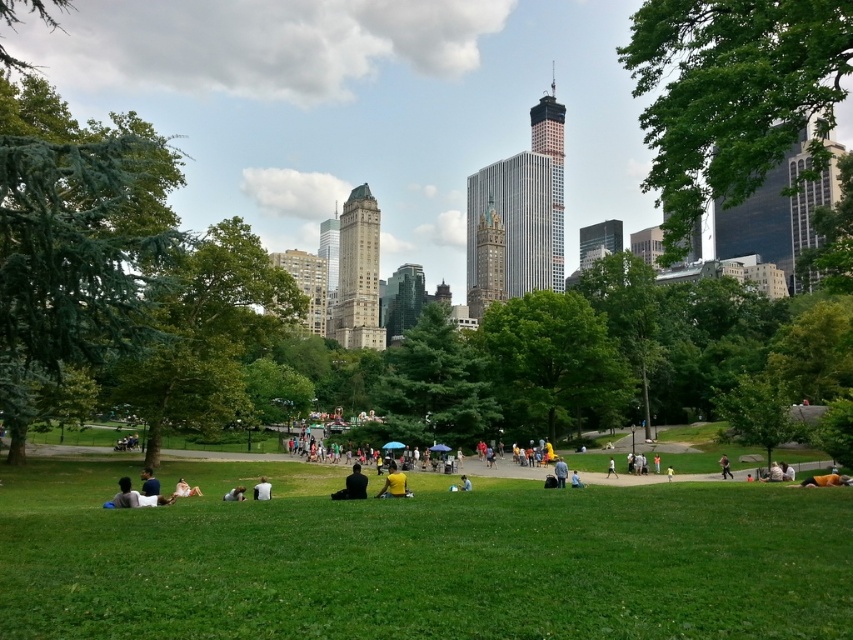
You are standing in the park and want to take a photo of the light brown leather jacket at center. To ensure it appears larger in your photo, should you move closer to or farther away from the green grassy field at center?

To make the light brown leather jacket at center appear larger in the photo, you should move closer to the green grassy field at center because the green grassy field at center is closer to the viewer than the light brown leather jacket at center. Moving closer to the field would also bring you closer to the jacket, making it larger in the frame.

You are a park ranger who needs to check the distance between the green grassy field at center and the light brown leather jacket at center. According to the park map, the minimum safe distance for public gatherings is 65 meters. Is the current distance compliant with the safety guidelines?

The green grassy field at center and the light brown leather jacket at center are 64.95 meters apart from each other, which is just below the required 65 meters. Therefore, the current distance does not comply with the safety guidelines.

You are standing in the park and want to reach a specific point marked at coordinates point (360, 486). If your current position is 50 feet away from this point, how much farther do you need to walk to reach it?

The distance of point (360, 486) from viewer is 492.84 feet. Since you are currently 50 feet away, you need to walk an additional 442.84 feet to reach the point.